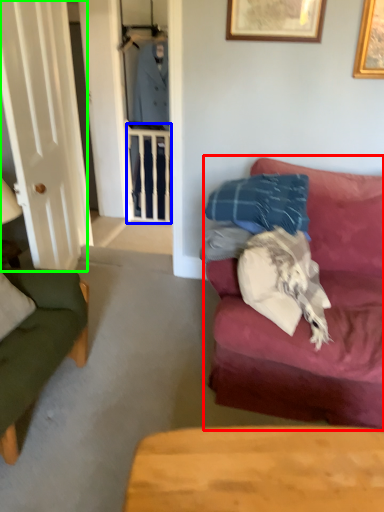
Question: Considering the real-world distances, which object is farthest from studio couch (highlighted by a red box)? balustrade (highlighted by a blue box) or glass door (highlighted by a green box)?

Choices:
 (A) balustrade
 (B) glass door

Answer: (A)